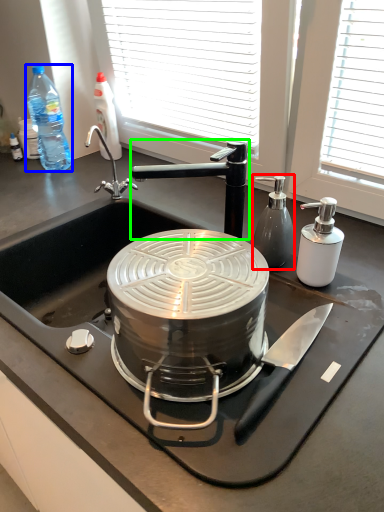
Question: Which is farther away from bottle (highlighted by a red box)? bottle (highlighted by a blue box) or tap (highlighted by a green box)?

Choices:
 (A) bottle
 (B) tap

Answer: (A)